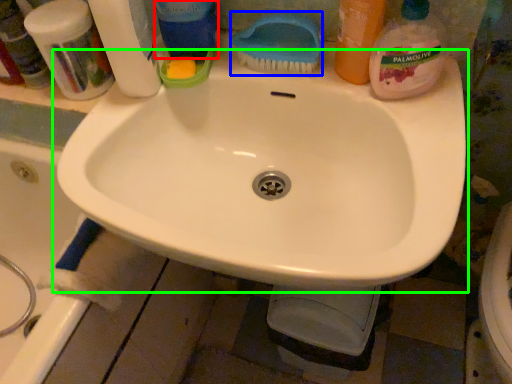
Question: Based on their relative distances, which object is nearer to cleaning product (highlighted by a red box)? Choose from brush (highlighted by a blue box) and sink (highlighted by a green box).

Choices:
 (A) brush
 (B) sink

Answer: (A)